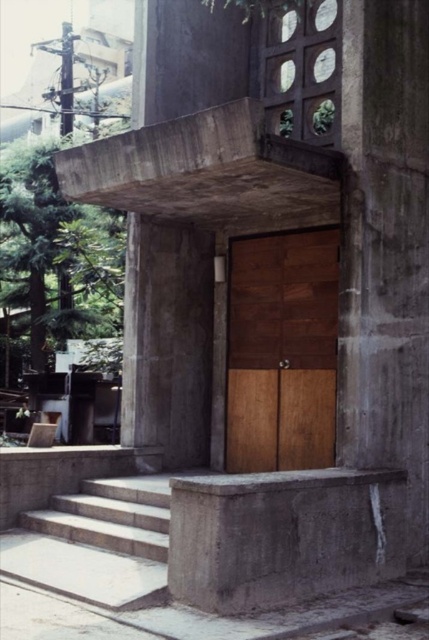
Question: Observing the image, what is the correct spatial positioning of green leafy tree at left in reference to white concrete stairs at lower left?

Choices:
 (A) above
 (B) below

Answer: (A)

Question: Does wooden door at center appear over white concrete stairs at lower left?

Choices:
 (A) yes
 (B) no

Answer: (A)

Question: Which is nearer to the green leafy tree at left?

Choices:
 (A) white concrete stairs at lower left
 (B) wooden door at center

Answer: (B)

Question: Which point appears closest to the camera in this image?

Choices:
 (A) coord(20,531)
 (B) coord(51,332)
 (C) coord(242,248)

Answer: (A)

Question: Is the position of wooden door at center less distant than that of green leafy tree at left?

Choices:
 (A) yes
 (B) no

Answer: (A)

Question: Which point is farther from the camera taking this photo?

Choices:
 (A) (15, 536)
 (B) (81, 256)

Answer: (B)